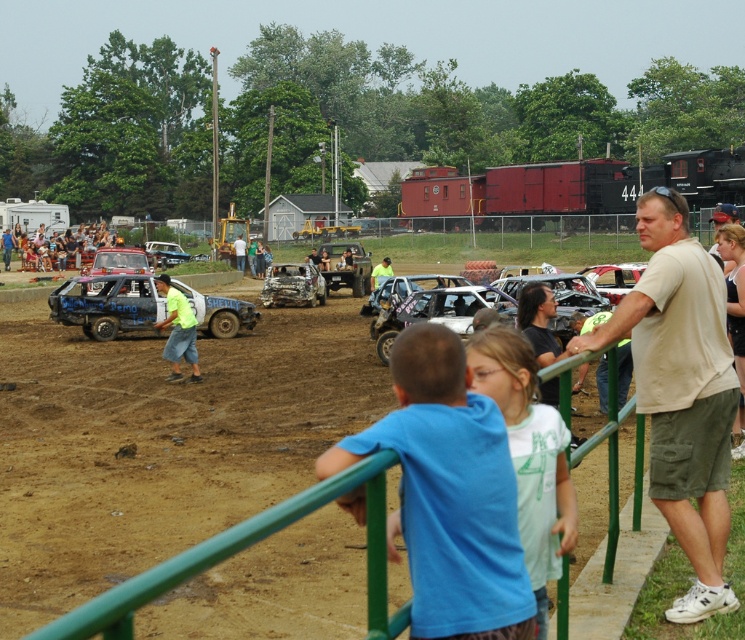
Question: Can you confirm if white cotton shirt at center is smaller than rusty metal car at center?

Choices:
 (A) yes
 (B) no

Answer: (A)

Question: Among these objects, which one is farthest from the camera?

Choices:
 (A) rusty metal car at center
 (B) matte black car at center

Answer: (B)

Question: Which object is the closest to the beige cotton shirt at right?

Choices:
 (A) blue cotton shirt at center
 (B) white cotton shirt at center
 (C) blue matte car at center

Answer: (B)

Question: Is beige cotton shirt at right positioned in front of matte black car at center?

Choices:
 (A) no
 (B) yes

Answer: (B)

Question: Which object appears closest to the camera in this image?

Choices:
 (A) white cotton shirt at center
 (B) matte black car at center
 (C) shiny silver car at center
 (D) blue matte car at center

Answer: (A)

Question: Is blue matte car at center smaller than rusty metal wreck at center?

Choices:
 (A) no
 (B) yes

Answer: (B)